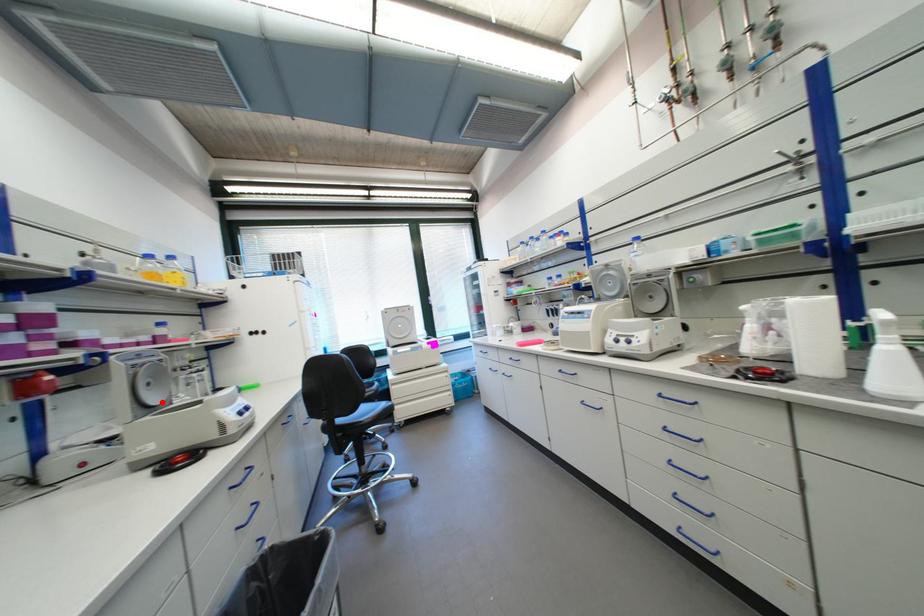
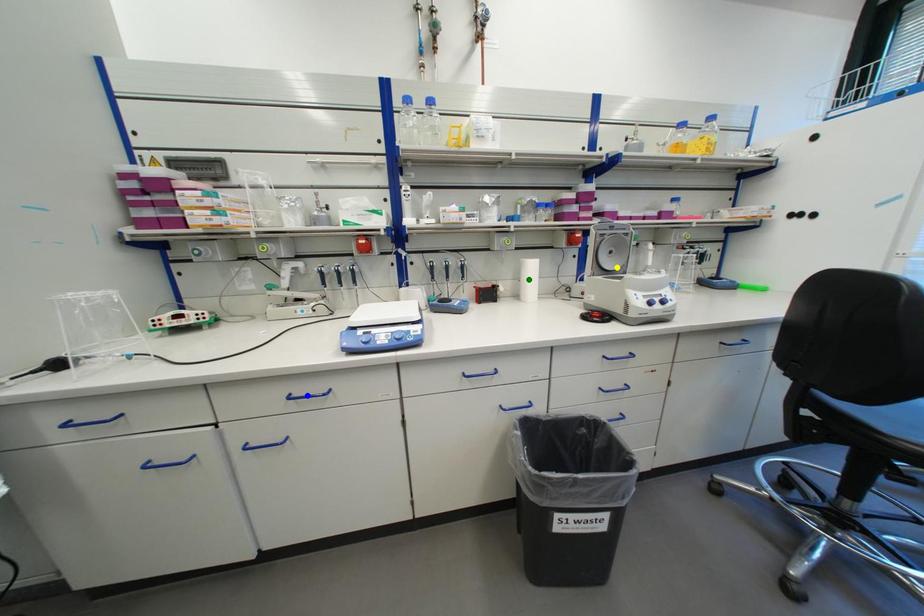
Question: I am providing you with two images of the same scene from different viewpoints. A red point is marked on the first image. You are given multiple points on the second image. Which point in image 2 represents the same 3d spot as the red point in image 1?

Choices:
 (A) green point
 (B) blue point
 (C) yellow point

Answer: (C)